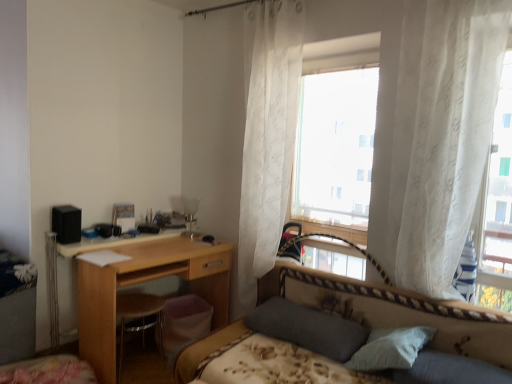
Question: Is point (178, 382) positioned closer to the camera than point (111, 370)?

Choices:
 (A) closer
 (B) farther

Answer: (A)

Question: In terms of size, does floral-patterned fabric bed at center appear bigger or smaller than wooden desk at center?

Choices:
 (A) small
 (B) big

Answer: (B)

Question: Considering the real-world distances, which object is farthest from the white sheer curtains at upper center, which is counted as the 1th window, starting from the left?

Choices:
 (A) white sheer curtain at center, the 1th curtain viewed from the back
 (B) floral-patterned fabric bed at center
 (C) wooden desk at center
 (D) white sheer curtain at upper right, the second curtain in the left-to-right sequence
 (E) white sheer curtain at right, acting as the second window starting from the left

Answer: (C)

Question: Based on their relative distances, which object is farther from the floral-patterned fabric bed at center?

Choices:
 (A) white sheer curtain at upper right, placed as the first curtain when sorted from front to back
 (B) brown leather swivel chair at lower left
 (C) white sheer curtains at upper center, placed as the 2th window when sorted from front to back
 (D) white sheer curtain at right, which appears as the 2th window when viewed from the back
 (E) white sheer curtain at center, which ranks as the 2th curtain in right-to-left order

Answer: (B)